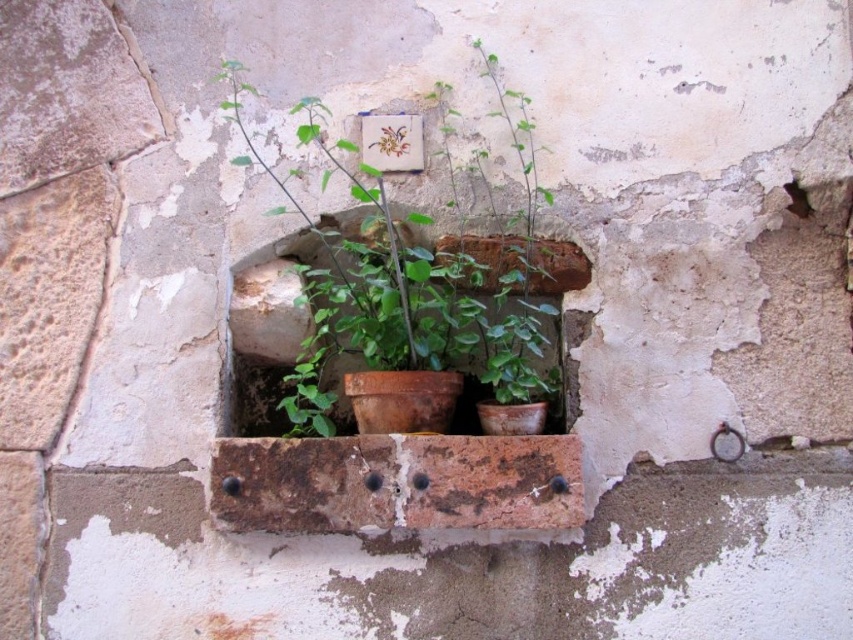
Does brown terracotta pot at center have a greater width compared to terracotta pot at center?

Yes, brown terracotta pot at center is wider than terracotta pot at center.

What do you see at coordinates (416, 284) in the screenshot?
I see `brown terracotta pot at center` at bounding box center [416, 284].

Who is more forward, [543,417] or [364,148]?

Point [543,417] is in front.

Locate an element on the screen. This screenshot has width=853, height=640. brown terracotta pot at center is located at coordinates (416, 284).